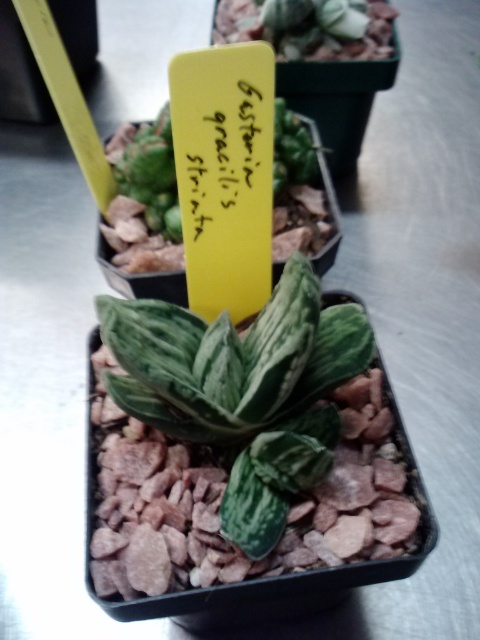
Is point (279, 404) positioned after point (217, 84)?

Yes, it is.

Which is in front, point (190, 356) or point (179, 180)?

Point (179, 180)

Where is `green striped succulent at center`? The image size is (480, 640). green striped succulent at center is located at coordinates (243, 388).

The width and height of the screenshot is (480, 640). What do you see at coordinates (224, 160) in the screenshot?
I see `yellow paper at center` at bounding box center [224, 160].

How much distance is there between yellow paper at center and green textured succulent at center?

yellow paper at center and green textured succulent at center are 32.92 centimeters apart.

Find the location of `yellow paper at center`. yellow paper at center is located at coordinates (224, 160).

Locate an element on the screen. The width and height of the screenshot is (480, 640). yellow paper at center is located at coordinates (224, 160).

Can you confirm if green striped succulent at center is wider than green textured succulent at center?

Incorrect, green striped succulent at center's width does not surpass green textured succulent at center's.

Is green striped succulent at center shorter than green textured succulent at center?

In fact, green striped succulent at center may be taller than green textured succulent at center.

Find the location of a particular element. green striped succulent at center is located at coordinates (243, 388).